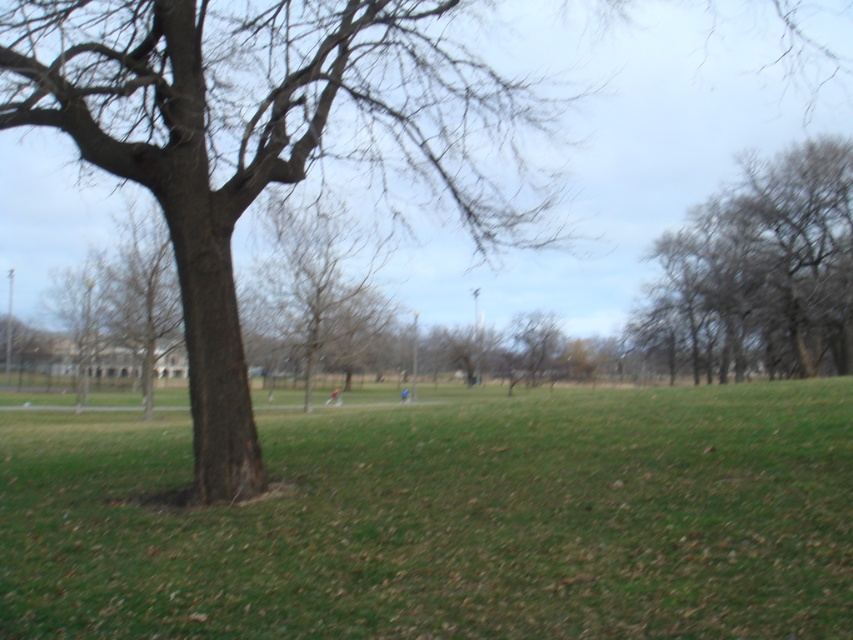
You are planning to place a bench between the gray textured tree at upper right and the bare wood tree at center. Which tree should the bench be closer to if you want it to be equidistant from both trees based on their widths?

The bench should be closer to the bare wood tree at center because the gray textured tree at upper right is wider, so positioning it nearer to the narrower tree balances the distance proportionally.

You are standing in the park and want to take a photo of the brown rough bark tree at left from the green grassy field at center. Which object will appear larger in the photo?

The brown rough bark tree at left will appear larger in the photo because it is taller than the green grassy field at center.

You are planning to take a photo of the gray textured tree at upper right and the bare wood tree at center in the park. Which tree should you focus on first if you want to capture both in a single frame without moving the camera?

You should focus on the gray textured tree at upper right first because it is larger in size than the bare wood tree at center, making it more prominent and easier to frame.